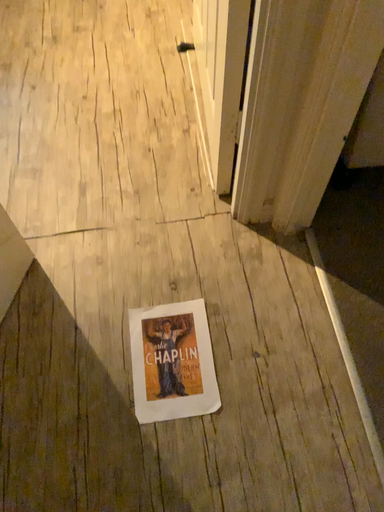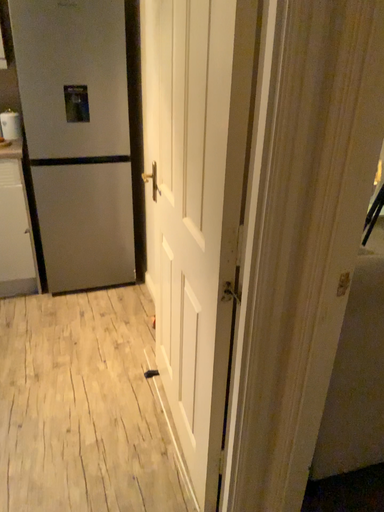
Question: Which way did the camera rotate in the video?

Choices:
 (A) rotated left
 (B) rotated right

Answer: (B)